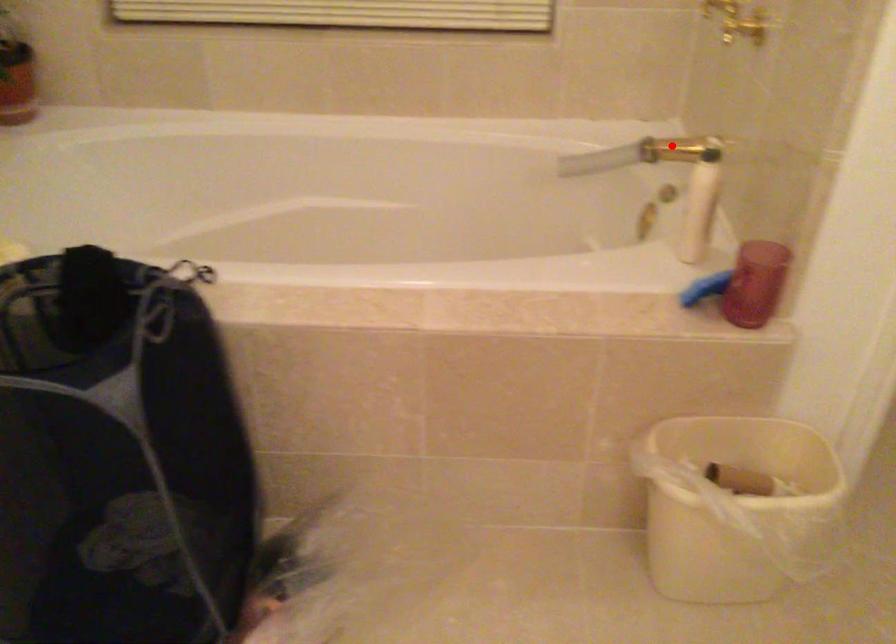
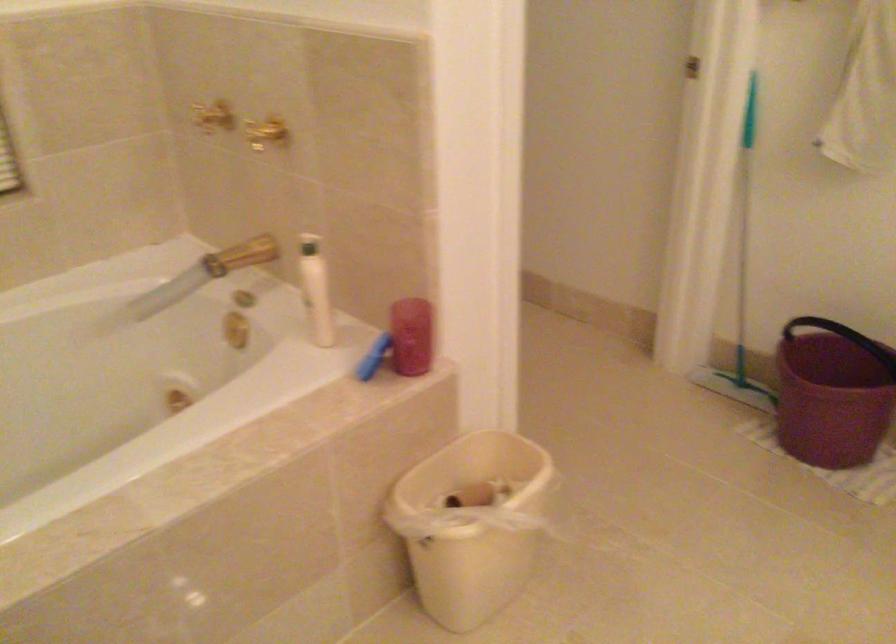
The point at the highlighted location is marked in the first image. Where is the corresponding point in the second image?

(240, 254)